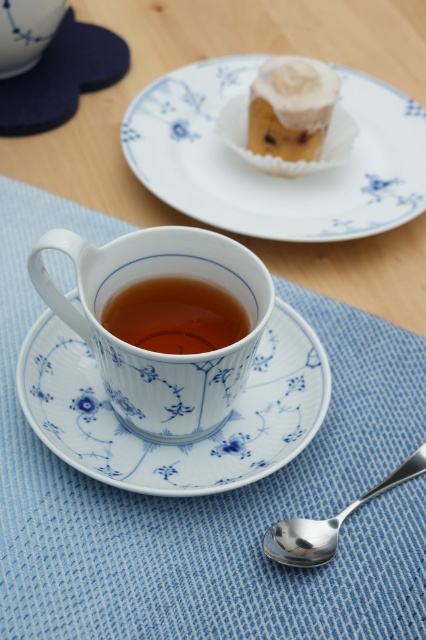
Looking at this image, who is lower down, white porcelain plate at upper center or silver metallic spoon at lower right?

silver metallic spoon at lower right is below.

Is point (374, 148) positioned before point (324, 529)?

That is False.

At what (x,y) coordinates should I click in order to perform the action: click on white porcelain plate at upper center. Please return your answer as a coordinate pair (x, y). Image resolution: width=426 pixels, height=640 pixels. Looking at the image, I should click on (273, 173).

Does white porcelain plate at upper center have a greater width compared to white porcelain saucer at center?

Correct, the width of white porcelain plate at upper center exceeds that of white porcelain saucer at center.

Which is above, white porcelain plate at upper center or white porcelain saucer at center?

white porcelain plate at upper center is higher up.

Does point (224, 228) lie in front of point (52, 396)?

No, it is not.

Where is `white porcelain plate at upper center`? white porcelain plate at upper center is located at coordinates (273, 173).

In the scene shown: Can you confirm if blue woven placemat at lower center is bigger than white porcelain saucer at center?

Indeed, blue woven placemat at lower center has a larger size compared to white porcelain saucer at center.

Where is `blue woven placemat at lower center`? The width and height of the screenshot is (426, 640). blue woven placemat at lower center is located at coordinates (213, 496).